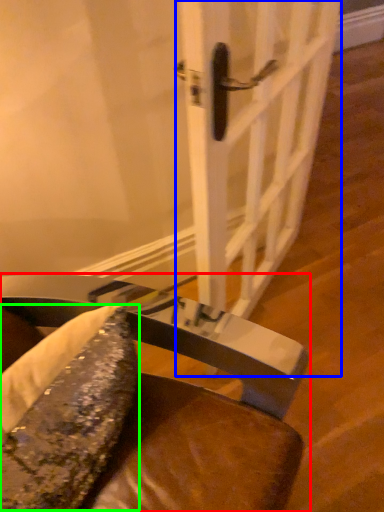
Question: Based on their relative distances, which object is nearer to chair (highlighted by a red box)? Choose from door (highlighted by a blue box) and food (highlighted by a green box).

Choices:
 (A) door
 (B) food

Answer: (B)